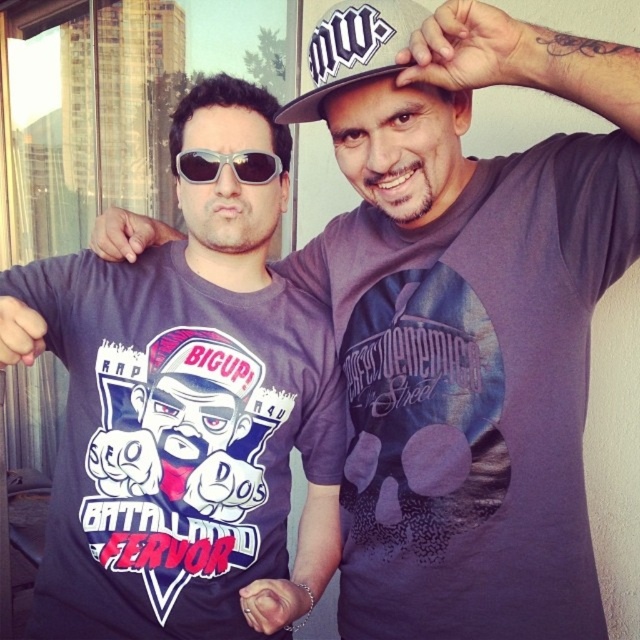
Question: Among these objects, which one is nearest to the camera?

Choices:
 (A) white textured baseball cap at upper center
 (B) sunglasses at center

Answer: (A)

Question: Considering the relative positions of matte gray t-shirt at center and sunglasses at center in the image provided, where is matte gray t-shirt at center located with respect to sunglasses at center?

Choices:
 (A) left
 (B) right

Answer: (A)

Question: Is white textured baseball cap at upper center to the right of sunglasses at center from the viewer's perspective?

Choices:
 (A) yes
 (B) no

Answer: (A)

Question: Can you confirm if matte gray t-shirt at center is positioned to the left of sunglasses at center?

Choices:
 (A) yes
 (B) no

Answer: (A)

Question: Based on their relative distances, which object is farther from the white textured baseball cap at upper center?

Choices:
 (A) sunglasses at center
 (B) matte gray t-shirt at center

Answer: (B)

Question: Which is farther from the white textured baseball cap at upper center?

Choices:
 (A) sunglasses at center
 (B) matte gray t-shirt at center

Answer: (B)